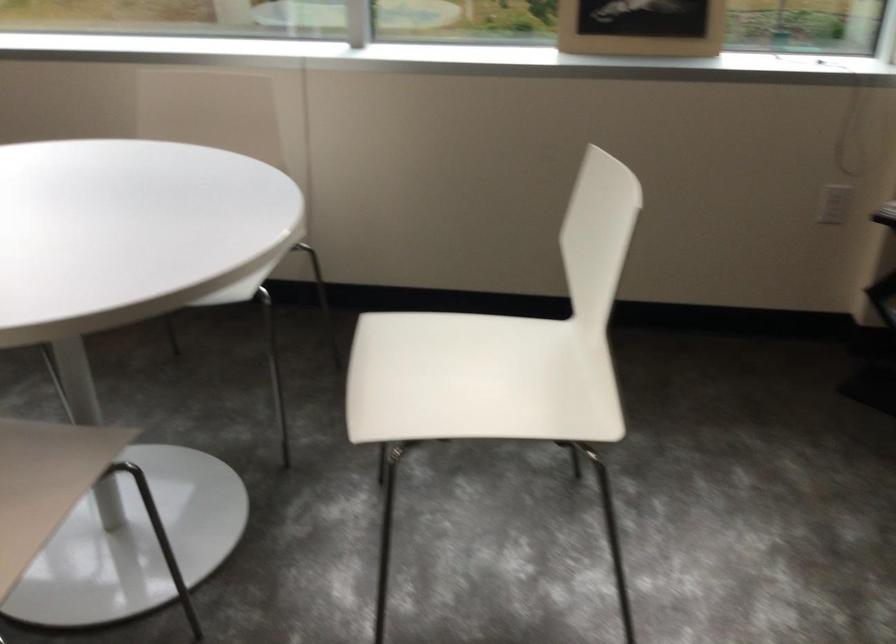
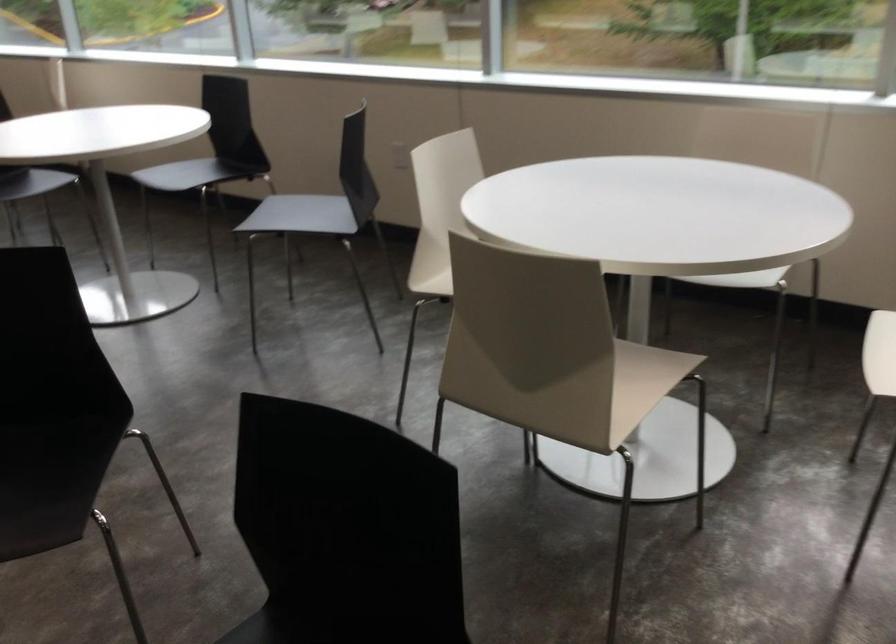
Question: The images are taken continuously from a first-person perspective. In which direction is your viewpoint rotating?

Choices:
 (A) Left
 (B) Right
 (C) Up
 (D) Down

Answer: (A)